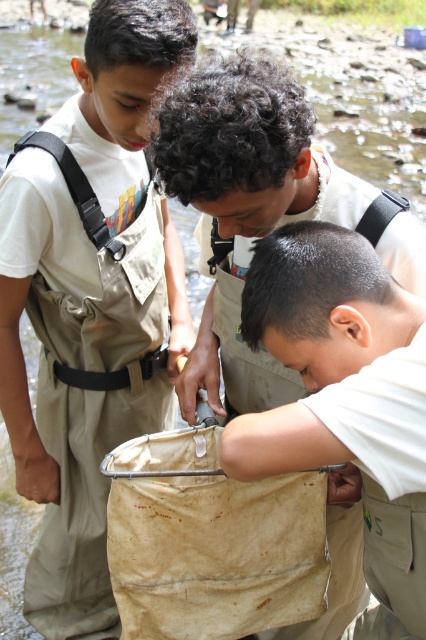
You are a hiker who needs to retrieve an item from the tan fabric bag at center. The matte khaki waders at left are in your way. Can you move the waders to access the bag?

The matte khaki waders at left is positioned under the tan fabric bag at center, so moving the waders would allow you to access the bag.

You are standing on the bank of the stream and see the matte khaki waders at left and the white matte cloth at lower center. Which object is closer to your left side?

The matte khaki waders at left is closer to your left side because it is positioned to the left of the white matte cloth at lower center.

You are planning to carry a new item that is as wide as the tan fabric bag at center. Based on the scene, can the matte khaki waders at left accommodate this item in terms of width?

The matte khaki waders at left are wider than the tan fabric bag at center, so they can accommodate an item of the same width as the tan fabric bag at center.